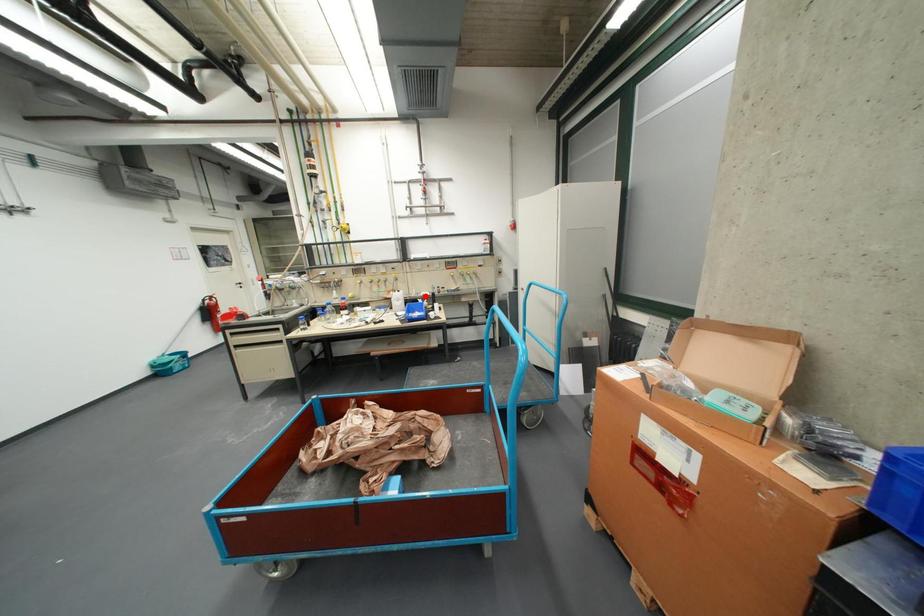
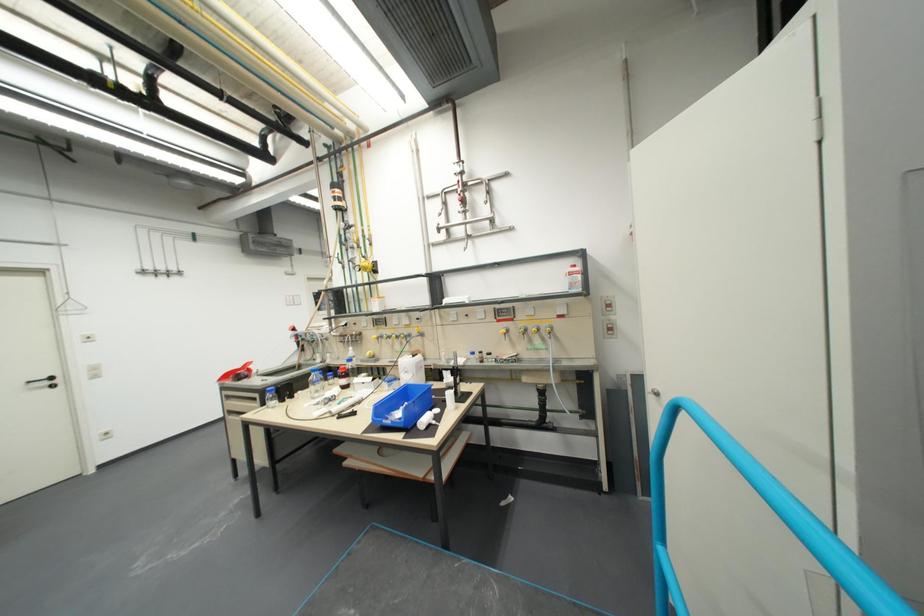
Question: I am providing you with two images of the same scene from different viewpoints. Given a red point in image1, look at the same physical point in image2. Is it:

Choices:
 (A) Closer to the viewpoint
 (B) Farther from the viewpoint

Answer: (B)